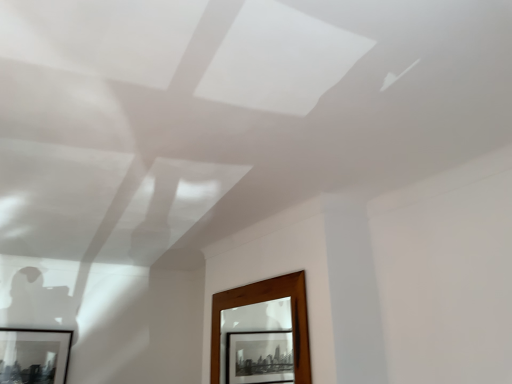
The width and height of the screenshot is (512, 384). Describe the element at coordinates (34, 356) in the screenshot. I see `black matte picture frame at lower left` at that location.

Find the location of a particular element. This screenshot has width=512, height=384. black matte picture frame at lower left is located at coordinates (34, 356).

Identify the location of wooden frame at lower center. (261, 333).

Describe the element at coordinates (261, 333) in the screenshot. I see `wooden frame at lower center` at that location.

Where is `black matte picture frame at lower left`? Image resolution: width=512 pixels, height=384 pixels. black matte picture frame at lower left is located at coordinates (34, 356).

Is black matte picture frame at lower left at the right side of wooden frame at lower center?

A: No, black matte picture frame at lower left is not to the right of wooden frame at lower center.

Which is behind, black matte picture frame at lower left or wooden frame at lower center?

Positioned behind is black matte picture frame at lower left.

Considering the positions of point (22, 356) and point (300, 295), is point (22, 356) closer or farther from the camera than point (300, 295)?

Point (22, 356) is farther from the camera than point (300, 295).

From the image's perspective, does black matte picture frame at lower left appear higher than wooden frame at lower center?

Actually, black matte picture frame at lower left appears below wooden frame at lower center in the image.

From a real-world perspective, which is physically below, black matte picture frame at lower left or wooden frame at lower center?

From a 3D spatial view, black matte picture frame at lower left is below.

Can you confirm if black matte picture frame at lower left is wider than wooden frame at lower center?

Yes, black matte picture frame at lower left is wider than wooden frame at lower center.

Looking at this image, in terms of height, does black matte picture frame at lower left look taller or shorter compared to wooden frame at lower center?

Considering their sizes, black matte picture frame at lower left has less height than wooden frame at lower center.

Between black matte picture frame at lower left and wooden frame at lower center, which one has larger size?

wooden frame at lower center.

Choose the correct answer: Is black matte picture frame at lower left inside wooden frame at lower center or outside it?

black matte picture frame at lower left is not inside wooden frame at lower center, it's outside.

Looking at this image, is black matte picture frame at lower left not near wooden frame at lower center?

black matte picture frame at lower left is positioned a significant distance from wooden frame at lower center.

Is black matte picture frame at lower left oriented towards wooden frame at lower center?

Yes, black matte picture frame at lower left is facing wooden frame at lower center.

What's the angular difference between black matte picture frame at lower left and wooden frame at lower center's facing directions?

black matte picture frame at lower left and wooden frame at lower center are facing 90.8 degrees away from each other.

The width and height of the screenshot is (512, 384). What are the coordinates of `window above the black matte picture frame at lower left (from a real-world perspective)` in the screenshot? It's located at (261, 333).

Between wooden frame at lower center and black matte picture frame at lower left, which one appears on the right side from the viewer's perspective?

Positioned to the right is wooden frame at lower center.

Is wooden frame at lower center further to camera compared to black matte picture frame at lower left?

No, wooden frame at lower center is closer to the camera.

Is point (292, 376) closer or farther from the camera than point (36, 350)?

Point (292, 376) appears to be farther away from the viewer than point (36, 350).

From the image's perspective, between wooden frame at lower center and black matte picture frame at lower left, who is located below?

black matte picture frame at lower left.

From a real-world perspective, between wooden frame at lower center and black matte picture frame at lower left, who is vertically lower?

In real-world perspective, black matte picture frame at lower left is lower.

Considering the sizes of objects wooden frame at lower center and black matte picture frame at lower left in the image provided, who is wider, wooden frame at lower center or black matte picture frame at lower left?

Wider between the two is black matte picture frame at lower left.

Is wooden frame at lower center taller than black matte picture frame at lower left?

Yes.

From the picture: Who is smaller, wooden frame at lower center or black matte picture frame at lower left?

black matte picture frame at lower left.

Do you think wooden frame at lower center is within black matte picture frame at lower left, or outside of it?

The correct answer is: outside.

Are wooden frame at lower center and black matte picture frame at lower left far apart?

→ wooden frame at lower center is positioned a significant distance from black matte picture frame at lower left.

Is wooden frame at lower center aimed at black matte picture frame at lower left?

No, wooden frame at lower center is not aimed at black matte picture frame at lower left.

How different are the orientations of wooden frame at lower center and black matte picture frame at lower left in degrees?

The angle between the facing direction of wooden frame at lower center and the facing direction of black matte picture frame at lower left is 90.8 degrees.

Where is `window to the right of black matte picture frame at lower left`? This screenshot has height=384, width=512. window to the right of black matte picture frame at lower left is located at coordinates (261, 333).

This screenshot has width=512, height=384. What are the coordinates of `window above the black matte picture frame at lower left (from a real-world perspective)` in the screenshot? It's located at (261, 333).

The width and height of the screenshot is (512, 384). In order to click on picture frame located underneath the wooden frame at lower center (from a real-world perspective) in this screenshot , I will do `click(34, 356)`.